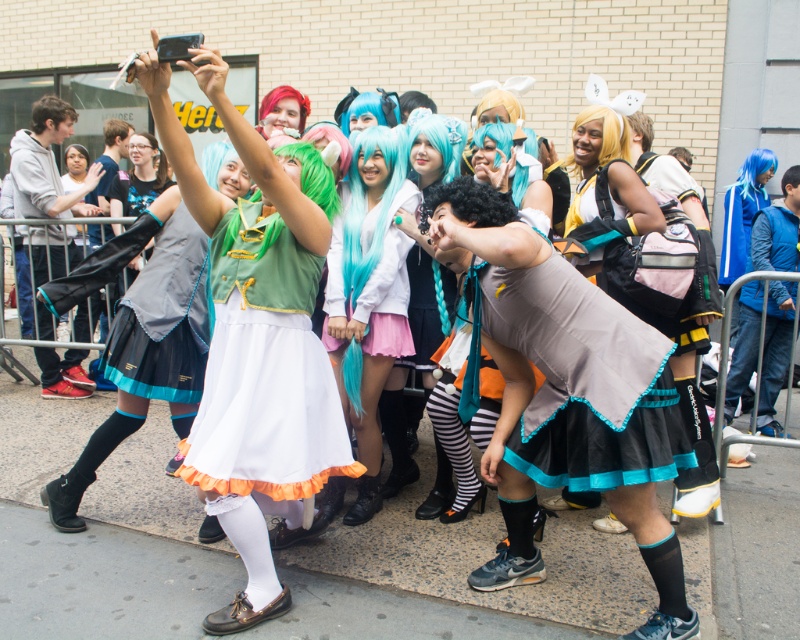
Between teal fabric wig at center and matte green dress at center, which one is positioned lower?

teal fabric wig at center is lower down.

Between point (424, 291) and point (126, 148), which one is positioned behind?

Point (126, 148)

At what (x,y) coordinates should I click in order to perform the action: click on teal fabric wig at center. Please return your answer as a coordinate pair (x, y). The width and height of the screenshot is (800, 640). Looking at the image, I should click on (416, 344).

Which of these two, matte gray dress at center or teal matte wig at center, stands shorter?

Standing shorter between the two is matte gray dress at center.

Does matte gray dress at center have a greater width compared to teal matte wig at center?

Yes, matte gray dress at center is wider than teal matte wig at center.

Measure the distance between matte gray dress at center and camera.

The distance of matte gray dress at center from camera is 7.51 feet.

Where is `matte gray dress at center`? matte gray dress at center is located at coordinates (584, 380).

Does green fabric dress at center have a larger size compared to gray hoodie at left?

Correct, green fabric dress at center is larger in size than gray hoodie at left.

Between green fabric dress at center and gray hoodie at left, which one has more height?

gray hoodie at left

Who is more distant from viewer, [288,289] or [20,172]?

The point [20,172] is more distant.

You are a GUI agent. You are given a task and a screenshot of the screen. Output one action in this format:
    pyautogui.click(x=<x>, y=<y>)
    Task: Click on the green fabric dress at center
    Image resolution: width=800 pixels, height=640 pixels.
    Given the screenshot: What is the action you would take?
    pyautogui.click(x=258, y=342)